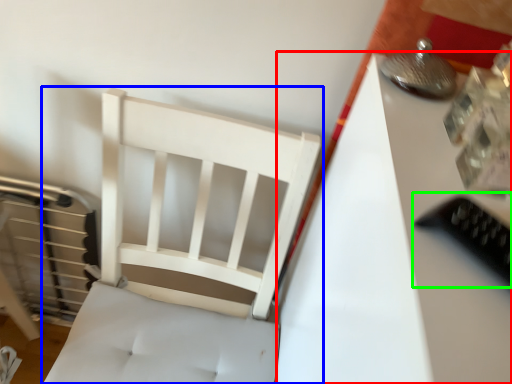
Question: Estimate the real-world distances between objects in this image. Which object is farther from table (highlighted by a red box), furniture (highlighted by a blue box) or equipment (highlighted by a green box)?

Choices:
 (A) furniture
 (B) equipment

Answer: (A)